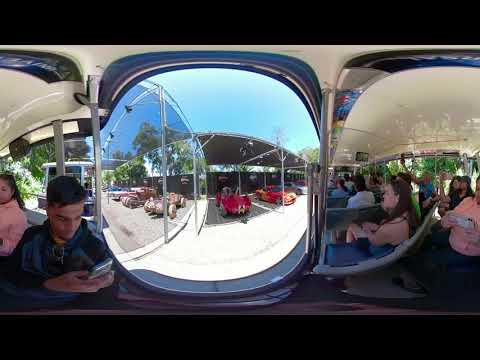
Where is `seats`? seats is located at coordinates (351, 251), (344, 217), (333, 199).